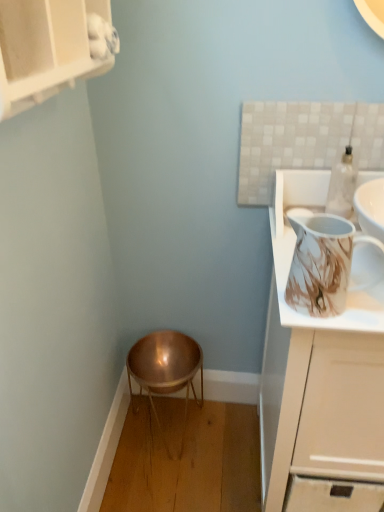
Question: Considering the relative positions of marble-patterned pitcher at upper right and copper metallic stool at lower center in the image provided, is marble-patterned pitcher at upper right to the right of copper metallic stool at lower center from the viewer's perspective?

Choices:
 (A) no
 (B) yes

Answer: (B)

Question: From the image's perspective, is marble-patterned pitcher at upper right located beneath copper metallic stool at lower center?

Choices:
 (A) no
 (B) yes

Answer: (A)

Question: Is marble-patterned pitcher at upper right behind copper metallic stool at lower center?

Choices:
 (A) no
 (B) yes

Answer: (A)

Question: Is marble-patterned pitcher at upper right taller than copper metallic stool at lower center?

Choices:
 (A) no
 (B) yes

Answer: (A)

Question: Is marble-patterned pitcher at upper right to the left of copper metallic stool at lower center from the viewer's perspective?

Choices:
 (A) no
 (B) yes

Answer: (A)

Question: Is matte white cabinet at upper left, which ranks as the 1th cabinetry in left-to-right order, in front of or behind white glossy cabinet at upper right, the first cabinetry in the bottom-to-top sequence, in the image?

Choices:
 (A) behind
 (B) front

Answer: (B)

Question: From their relative heights in the image, would you say matte white cabinet at upper left, which is the second cabinetry from bottom to top, is taller or shorter than white glossy cabinet at upper right, the first cabinetry in the bottom-to-top sequence?

Choices:
 (A) tall
 (B) short

Answer: (B)

Question: From a real-world perspective, is matte white cabinet at upper left, which is the second cabinetry from bottom to top, physically located above or below white glossy cabinet at upper right, which is the first cabinetry in right-to-left order?

Choices:
 (A) above
 (B) below

Answer: (A)

Question: Considering the positions of matte white cabinet at upper left, the 1th cabinetry from the top, and white glossy cabinet at upper right, which is the first cabinetry in right-to-left order, in the image, is matte white cabinet at upper left, the 1th cabinetry from the top, wider or thinner than white glossy cabinet at upper right, which is the first cabinetry in right-to-left order,?

Choices:
 (A) thin
 (B) wide

Answer: (A)

Question: From the image's perspective, is copper metallic stool at lower center positioned above or below matte white cabinet at upper left, which is the second cabinetry from bottom to top?

Choices:
 (A) above
 (B) below

Answer: (B)

Question: Does point (170, 365) appear closer or farther from the camera than point (69, 47)?

Choices:
 (A) closer
 (B) farther

Answer: (B)

Question: In the image, is copper metallic stool at lower center positioned in front of or behind matte white cabinet at upper left, which is the second cabinetry from right to left?

Choices:
 (A) front
 (B) behind

Answer: (B)

Question: Do you think copper metallic stool at lower center is within matte white cabinet at upper left, which is the second cabinetry from bottom to top, or outside of it?

Choices:
 (A) outside
 (B) inside

Answer: (A)

Question: Considering the positions of copper metallic stool at lower center and marble-patterned pitcher at upper right in the image, is copper metallic stool at lower center bigger or smaller than marble-patterned pitcher at upper right?

Choices:
 (A) big
 (B) small

Answer: (A)

Question: Based on their positions, is copper metallic stool at lower center located to the left or right of marble-patterned pitcher at upper right?

Choices:
 (A) left
 (B) right

Answer: (A)